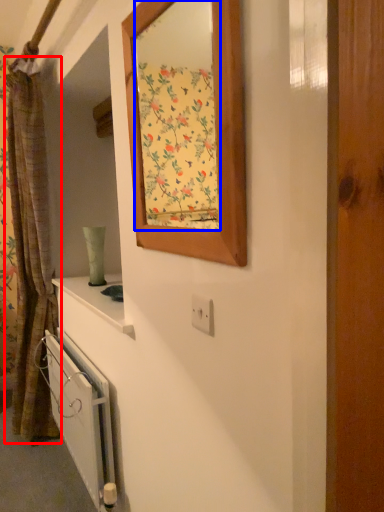
Question: Which of the following is the farthest to the observer, curtain (highlighted by a red box) or mirror (highlighted by a blue box)?

Choices:
 (A) curtain
 (B) mirror

Answer: (A)